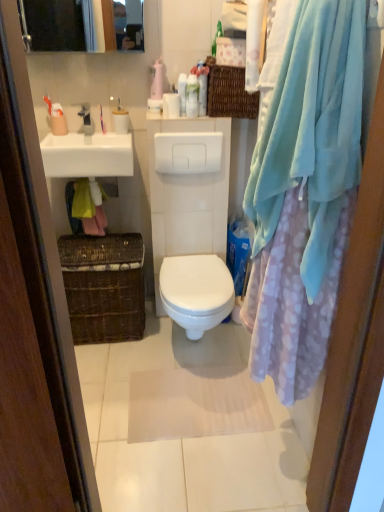
Locate an element on the screen. This screenshot has height=512, width=384. empty space that is ontop of white glossy sink at upper left (from a real-world perspective) is located at coordinates (90, 137).